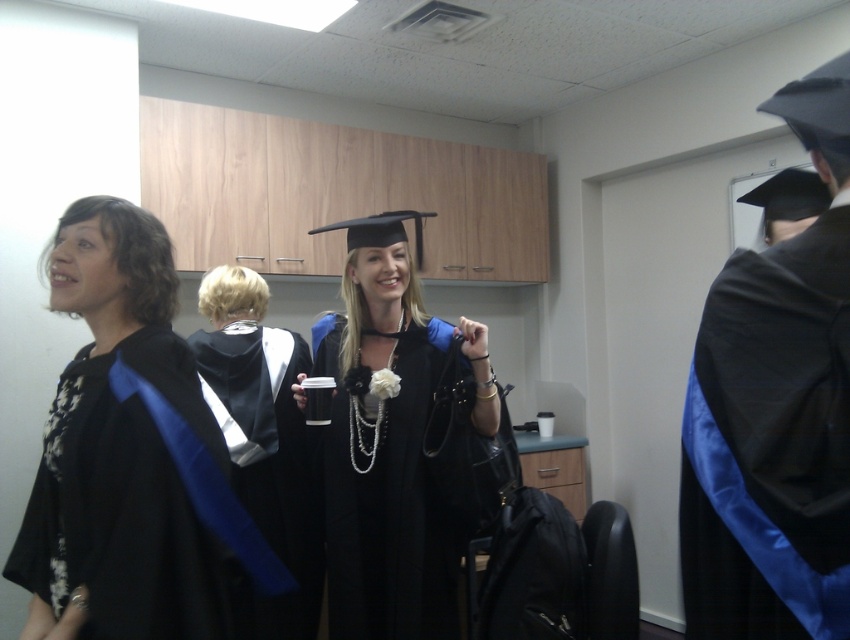
Question: From the image, what is the correct spatial relationship of matte black graduation gown at center in relation to satin black gown at center?

Choices:
 (A) left
 (B) right

Answer: (B)

Question: Which of the following is the farthest from the observer?

Choices:
 (A) black satin gown at left
 (B) satin black gown at center
 (C) matte black graduation gown at center
 (D) black satin graduation robe at right

Answer: (B)

Question: Can you confirm if black satin graduation robe at right is smaller than satin black gown at center?

Choices:
 (A) yes
 (B) no

Answer: (A)

Question: Which of the following is the farthest from the observer?

Choices:
 (A) (227, 442)
 (B) (352, 493)
 (C) (148, 428)

Answer: (A)

Question: Can you confirm if black satin gown at left is positioned above satin black gown at center?

Choices:
 (A) yes
 (B) no

Answer: (A)

Question: Which of the following is the farthest from the observer?

Choices:
 (A) (353, 444)
 (B) (802, 572)
 (C) (278, 513)
 (D) (160, 387)

Answer: (C)